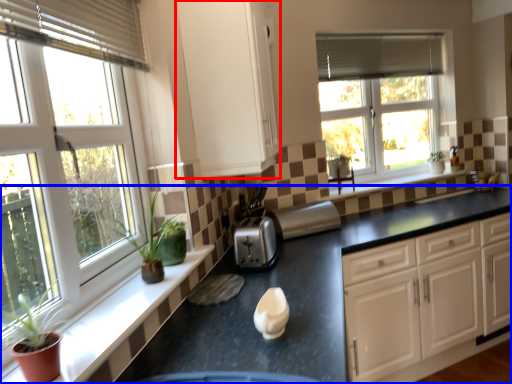
Question: Which object is closer to the camera taking this photo, cabinetry (highlighted by a red box) or countertop (highlighted by a blue box)?

Choices:
 (A) cabinetry
 (B) countertop

Answer: (B)